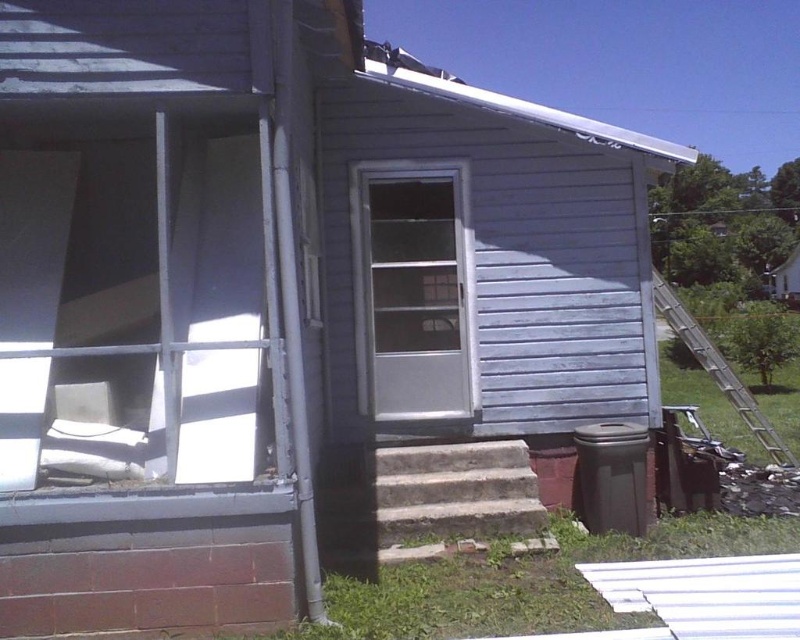
You are a delivery person trying to enter the house through the clear glass door at center. However, you notice the metallic silver ladder at right is blocking the entrance. Can you squeeze through the space between them?

The clear glass door at center is bigger than metallic silver ladder at right, so the ladder is smaller. Since the ladder is smaller, there might not be enough space to squeeze through the gap between them. It is recommended to move the ladder first before attempting to enter.

You are standing in front of the house and notice two points marked on the image. Which point, point (454, 376) or point (694, 328), is closer to you?

Point (454, 376) is closer to the viewer than point (694, 328).

You are a delivery person trying to deliver a package to the house. The package is too large to fit through the clear glass door at center. Can you use the metallic silver ladder at right to reach the window next to the door?

The clear glass door at center is wider than the metallic silver ladder at right, so the ladder may not be wide enough to safely reach the window next to the door. Consider using another method or checking for alternative access points.